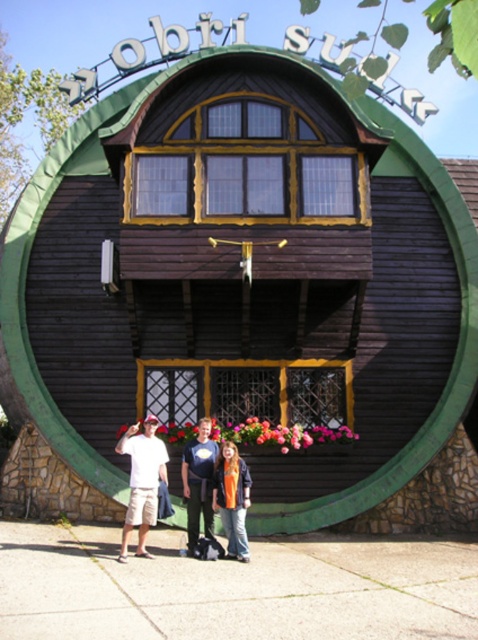
Question: Does white cotton shirt at center have a greater width compared to dark blue t-shirt at center?

Choices:
 (A) no
 (B) yes

Answer: (B)

Question: Which point is closer to the camera?

Choices:
 (A) orange fabric jacket at center
 (B) white cotton t-shirt at center

Answer: (B)

Question: Does dark blue t-shirt at center appear on the left side of orange fabric jacket at center?

Choices:
 (A) yes
 (B) no

Answer: (A)

Question: Which of the following is the closest to the observer?

Choices:
 (A) (235, 492)
 (B) (194, 540)
 (C) (212, 452)
 (D) (123, 522)

Answer: (B)

Question: Which object appears farthest from the camera in this image?

Choices:
 (A) dark blue t-shirt at center
 (B) orange fabric jacket at center

Answer: (A)

Question: Can you confirm if white cotton shirt at center is positioned above orange fabric jacket at center?

Choices:
 (A) yes
 (B) no

Answer: (A)